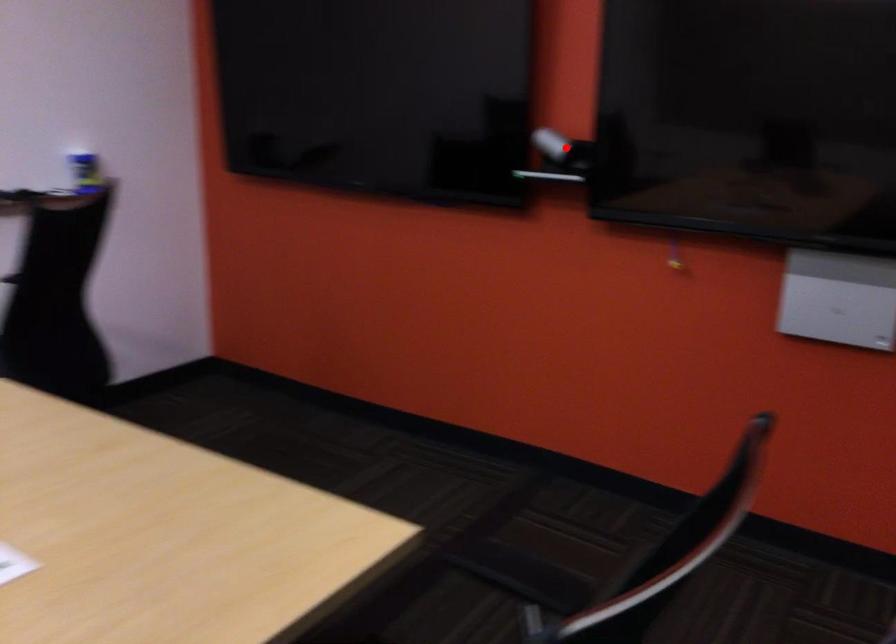
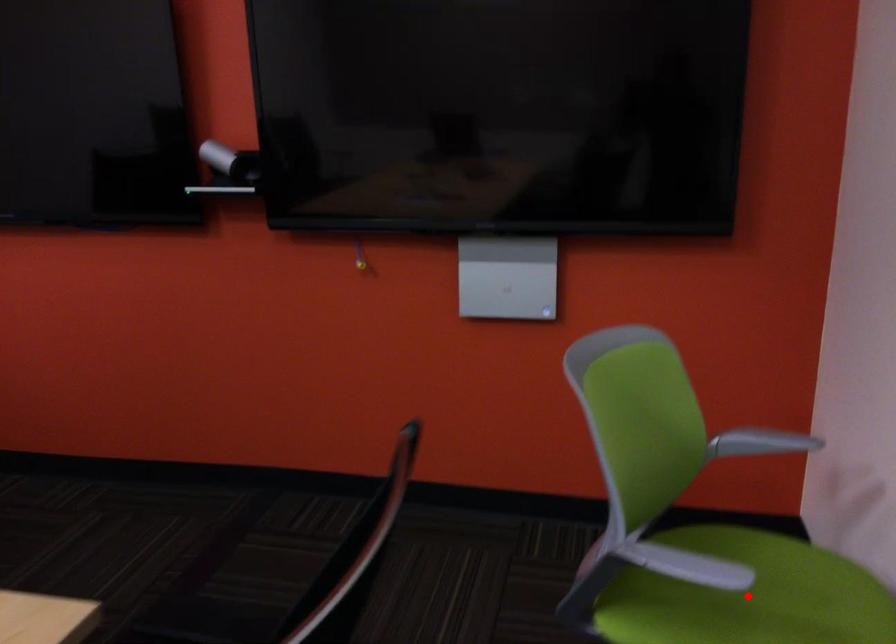
I am providing you with two images of the same scene from different viewpoints. A red point is marked on the first image and another point is marked on the second image. Is the red point in image1 aligned with the point shown in image2?

No